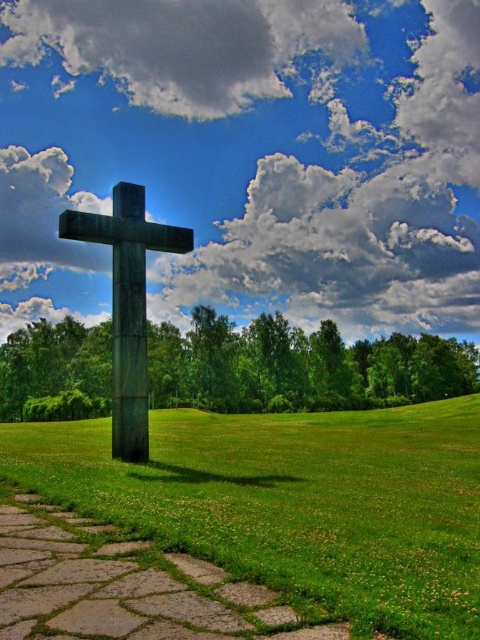
Is point (420, 602) less distant than point (112, 326)?

Yes, it is.

Consider the image. Which of these two, green grass at center or dark green stone cross at center, stands shorter?

Standing shorter between the two is green grass at center.

This screenshot has width=480, height=640. I want to click on green grass at center, so click(295, 502).

Does white fluffy cloud at upper center appear over dark green stone cross at center?

Yes, white fluffy cloud at upper center is above dark green stone cross at center.

Who is taller, white fluffy cloud at upper center or dark green stone cross at center?

With more height is white fluffy cloud at upper center.

Who is more distant from viewer, (297, 72) or (128, 246)?

The point (297, 72) is behind.

Locate an element on the screen. white fluffy cloud at upper center is located at coordinates (248, 156).

Who is more distant from viewer, (x=22, y=84) or (x=325, y=532)?

Positioned behind is point (x=22, y=84).

Describe the element at coordinates (248, 156) in the screenshot. I see `white fluffy cloud at upper center` at that location.

Which is in front, point (168, 156) or point (411, 550)?

Positioned in front is point (411, 550).

Locate an element on the screen. white fluffy cloud at upper center is located at coordinates (248, 156).